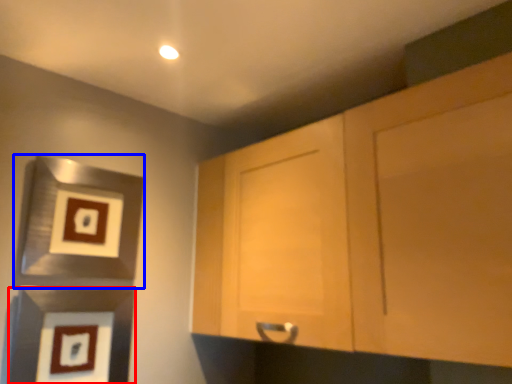
Question: Which object appears closest to the camera in this image, picture frame (highlighted by a red box) or picture frame (highlighted by a blue box)?

Choices:
 (A) picture frame
 (B) picture frame

Answer: (A)